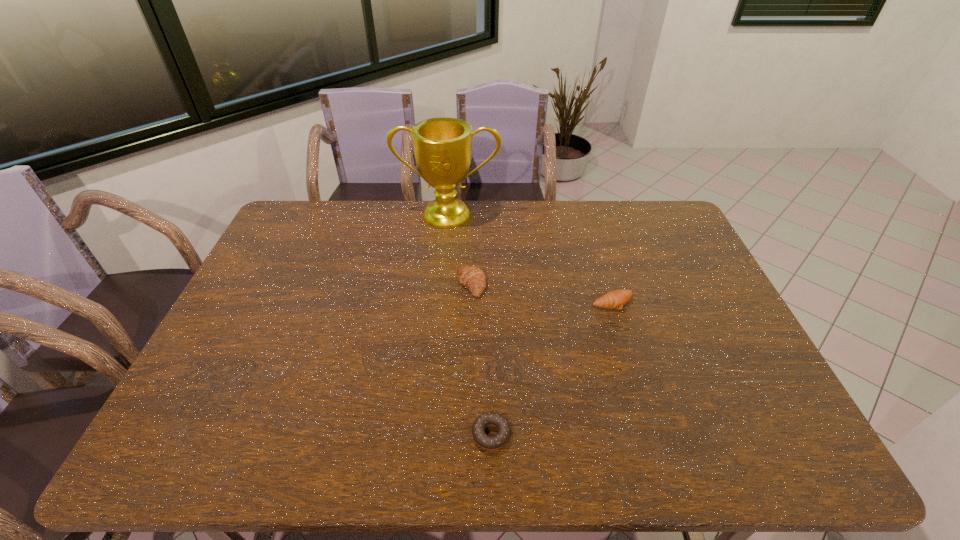
Locate an element on the screen. vacant region located 0.220m on the back of the right crescent roll is located at coordinates (x=596, y=248).

This screenshot has height=540, width=960. I want to click on vacant region located 0.250m on the back of the shortest object, so click(x=490, y=335).

I want to click on object at the far edge, so click(442, 146).

You are a GUI agent. You are given a task and a screenshot of the screen. Output one action in this format:
    pyautogui.click(x=<x>, y=<y>)
    Task: Click on the object that is at the near edge
    
    Given the screenshot: What is the action you would take?
    pyautogui.click(x=490, y=443)

Where is `free region at the far edge`? The width and height of the screenshot is (960, 540). free region at the far edge is located at coordinates (468, 205).

This screenshot has width=960, height=540. Find the location of `free space at the near edge`. free space at the near edge is located at coordinates (300, 458).

Where is `free region at the left edge of the desktop`? Image resolution: width=960 pixels, height=540 pixels. free region at the left edge of the desktop is located at coordinates (304, 267).

This screenshot has height=540, width=960. In the image, there is a desktop. In order to click on free space at the far left corner in this screenshot , I will do `click(302, 223)`.

At what (x,y) coordinates should I click in order to perform the action: click on vacant space at the near left corner of the desktop. Please return your answer as a coordinate pair (x, y). The image size is (960, 540). Looking at the image, I should click on (157, 449).

This screenshot has height=540, width=960. I want to click on unoccupied position between the doughnut and the shorter crescent roll, so click(x=552, y=368).